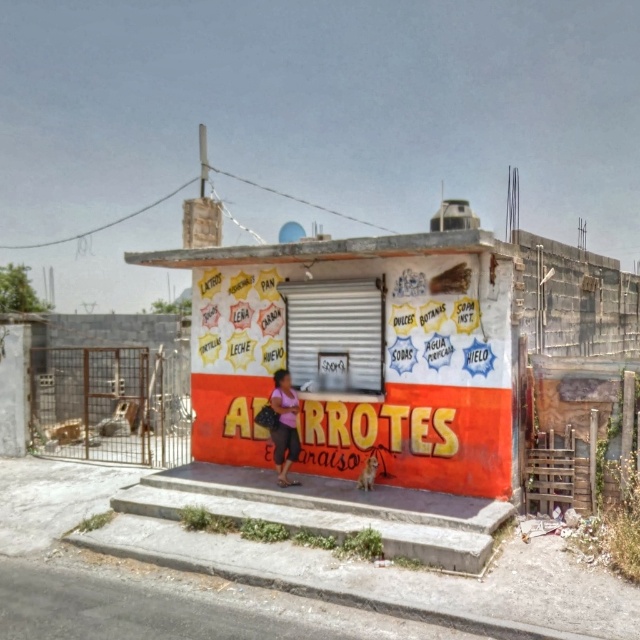
You are standing in front of the roadside stall. Where is the orange painted wall at center located?

The orange painted wall at center is located at point (358, 353).

You are a delivery person with a box that is 36 inches long. You need to place it between the orange painted wall at center and the pink fabric dress at center. Will the box fit in that space?

The distance between the orange painted wall at center and the pink fabric dress at center is 36.14 inches. Since the box is 36 inches long, it will fit with a small amount of space remaining.

You are standing in front of the roadside stall and want to determine which of the two points, point [289,244] or point [276,385], is nearer to you. Can you identify the closer one?

Point [289,244] is closer to the viewer than point [276,385].